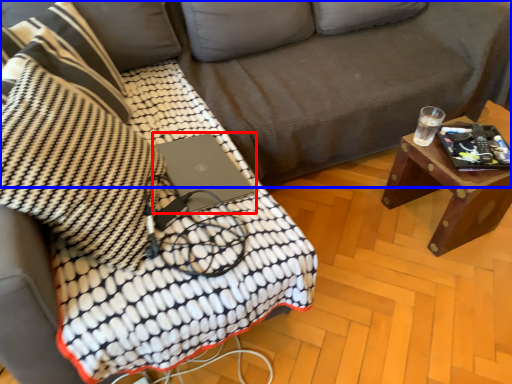
Question: Which object is further to the camera taking this photo, laptop (highlighted by a red box) or studio couch (highlighted by a blue box)?

Choices:
 (A) laptop
 (B) studio couch

Answer: (A)